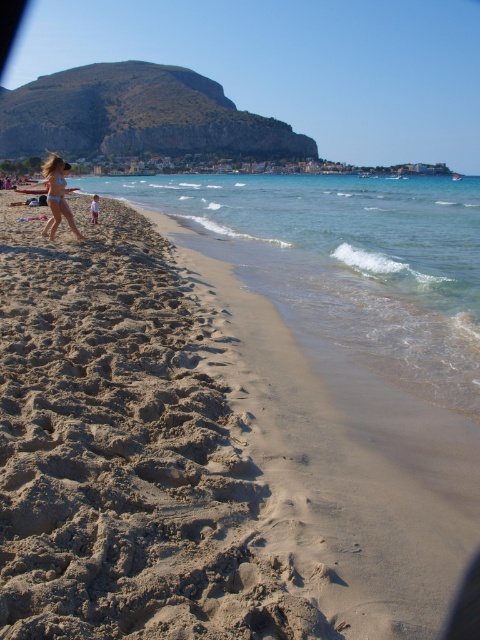
The width and height of the screenshot is (480, 640). In order to click on matte bikini at left in this screenshot , I will do `click(57, 196)`.

Is matte bikini at left thinner than white matte bikini at left?

No.

Does point (78, 234) come farther from viewer compared to point (50, 198)?

That is True.

This screenshot has height=640, width=480. Identify the location of matte bikini at left. (57, 196).

Is point (58, 182) more distant than point (97, 204)?

That is False.

Who is lower down, white matte bikini at left or beige sand at lower left?

white matte bikini at left is lower down.

Is point (63, 182) less distant than point (91, 204)?

Yes, point (63, 182) is closer to viewer.

Image resolution: width=480 pixels, height=640 pixels. Find the location of `white matte bikini at left`. white matte bikini at left is located at coordinates (56, 186).

Who is higher up, golden sand beach at left or matte bikini at left?

matte bikini at left

Between point (240, 317) and point (54, 179), which one is positioned in front?

Point (240, 317) is in front.

Does point (64, 499) come in front of point (54, 225)?

Yes, it is in front of point (54, 225).

Locate an element on the screen. The image size is (480, 640). golden sand beach at left is located at coordinates (189, 460).